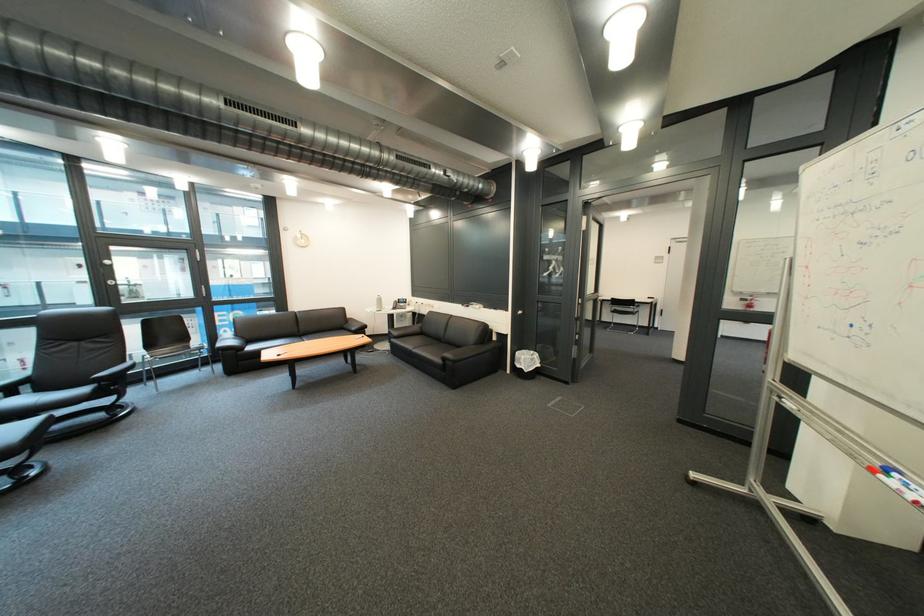
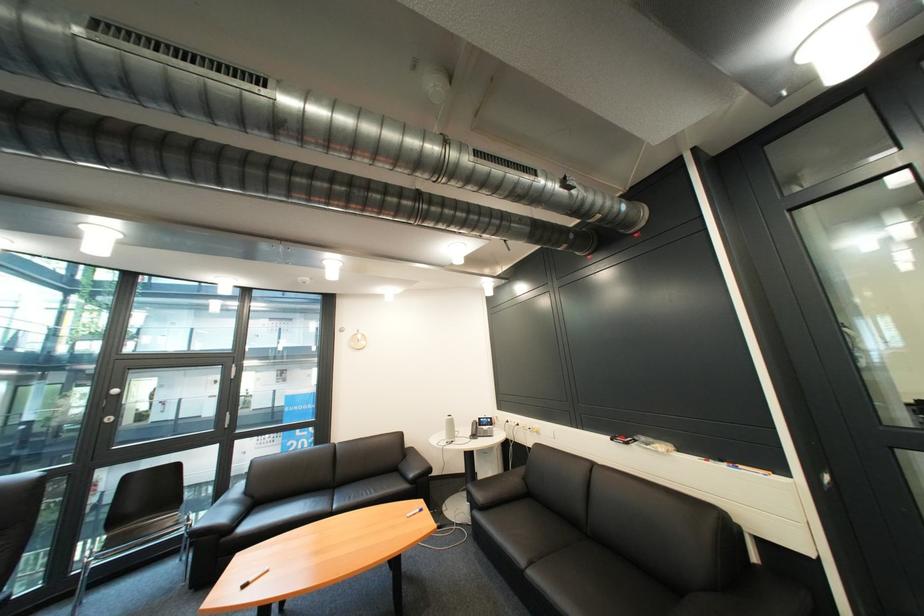
Question: I am providing you with two images of the same scene from different viewpoints. After the viewpoint changes to image2, which objects are now occluded?

Choices:
 (A) black sofa sitting surface
 (B) blue marker
 (C) black sofa armrest
 (D) none of these

Answer: (D)